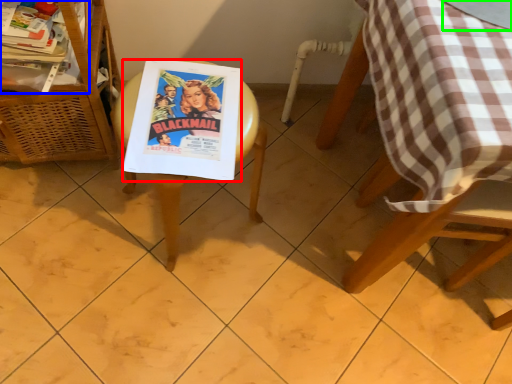
Question: Considering the real-world distances, which object is closest to comic book (highlighted by a red box)? magazine (highlighted by a blue box) or glass table (highlighted by a green box).

Choices:
 (A) magazine
 (B) glass table

Answer: (A)